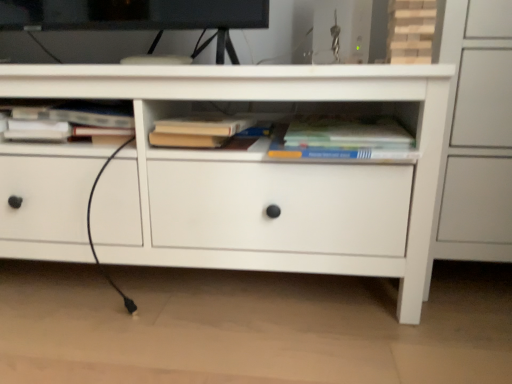
Identify the location of vacant space underneath white matte chest of drawers at center (from a real-world perspective). (176, 283).